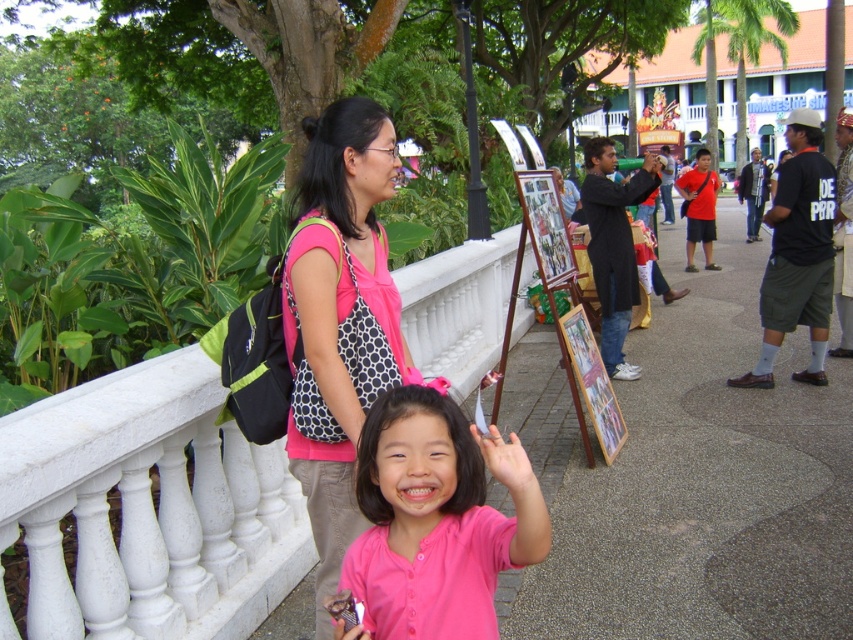
Does pink fabric bag at center have a smaller size compared to pink matte shirt at center?

No, pink fabric bag at center is not smaller than pink matte shirt at center.

Can you confirm if pink fabric bag at center is positioned to the right of pink matte shirt at center?

Incorrect, pink fabric bag at center is not on the right side of pink matte shirt at center.

Where is `pink fabric bag at center`? The height and width of the screenshot is (640, 853). pink fabric bag at center is located at coordinates (341, 314).